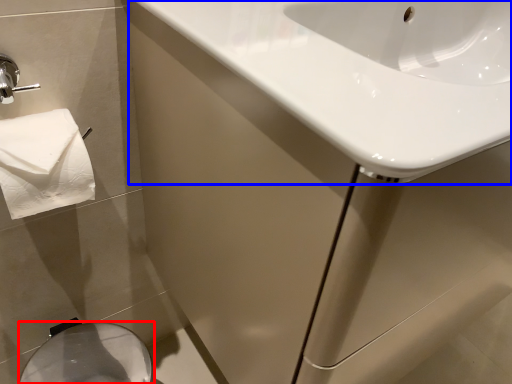
Question: Which point is closer to the camera, bidet (highlighted by a red box) or sink (highlighted by a blue box)?

Choices:
 (A) bidet
 (B) sink

Answer: (B)